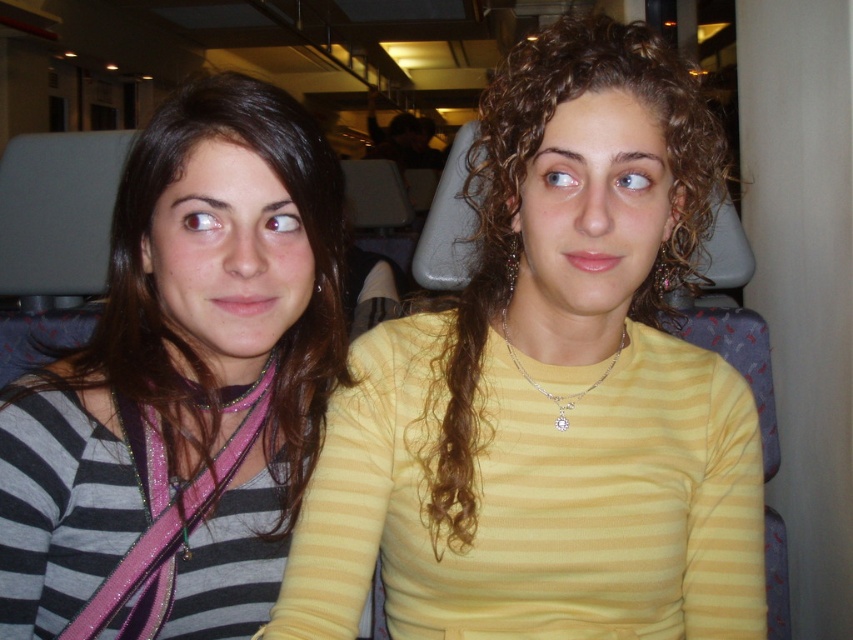
Question: Is yellow striped shirt at center above striped fabric shirt at left?

Choices:
 (A) no
 (B) yes

Answer: (B)

Question: Which object appears closest to the camera in this image?

Choices:
 (A) yellow striped shirt at center
 (B) striped fabric shirt at left

Answer: (A)

Question: Among these objects, which one is farthest from the camera?

Choices:
 (A) yellow striped shirt at center
 (B) striped fabric shirt at left

Answer: (B)

Question: Is yellow striped shirt at center below striped fabric shirt at left?

Choices:
 (A) no
 (B) yes

Answer: (A)

Question: From the image, what is the correct spatial relationship of yellow striped shirt at center in relation to striped fabric shirt at left?

Choices:
 (A) above
 (B) below

Answer: (A)